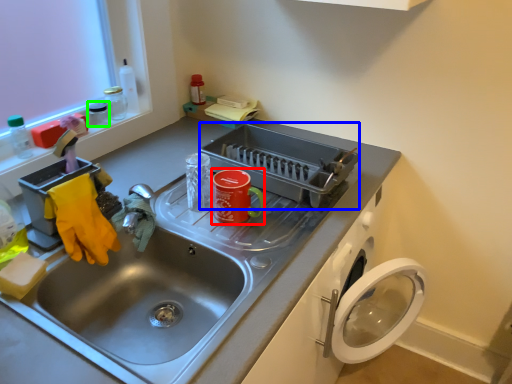
Question: Which object is positioned farthest from appliance (highlighted by a red box)? Select from appliance (highlighted by a blue box) and appliance (highlighted by a green box).

Choices:
 (A) appliance
 (B) appliance

Answer: (B)